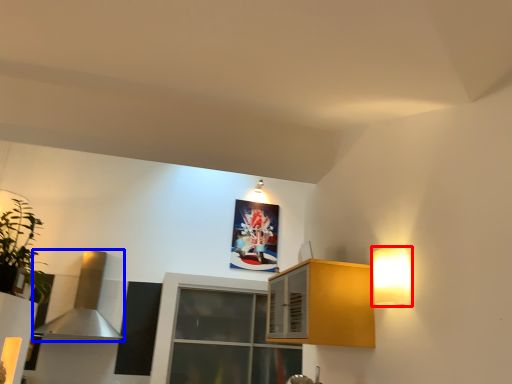
Question: Which point is further to the camera, light fixture (highlighted by a red box) or exhaust hood (highlighted by a blue box)?

Choices:
 (A) light fixture
 (B) exhaust hood

Answer: (B)